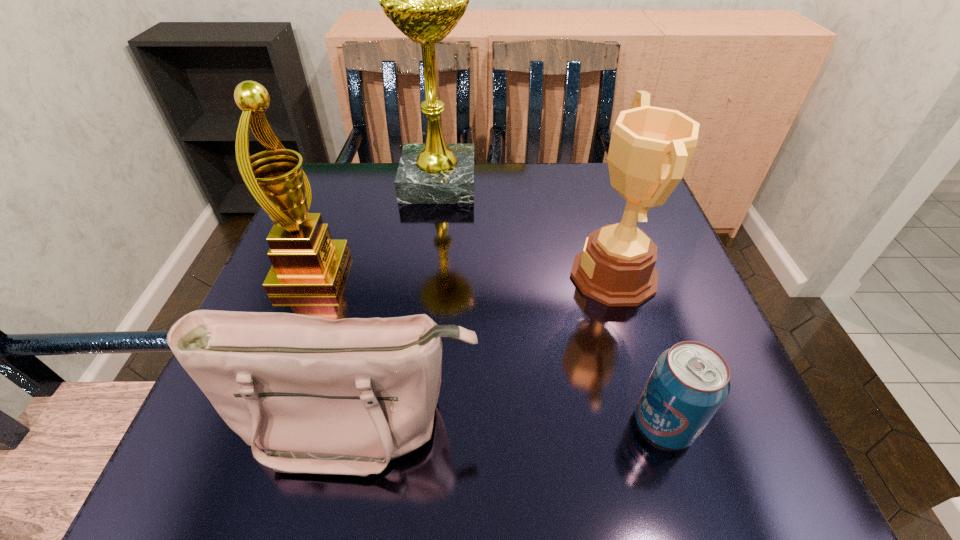
Locate an element on the screen. This screenshot has width=960, height=540. the second award from right to left is located at coordinates (425, 0).

Locate an element on the screen. the farthest object is located at coordinates (425, 0).

I want to click on the leftmost award, so point(305,259).

Where is `the rightmost award`? the rightmost award is located at coordinates (650, 149).

Locate an element on the screen. the second shortest object is located at coordinates (319, 396).

At what (x,y) coordinates should I click in order to perform the action: click on the shortest object. Please return your answer as a coordinate pair (x, y). The height and width of the screenshot is (540, 960). Looking at the image, I should click on (689, 382).

Where is `vacant space located on the front-facing side of the farthest award`? The width and height of the screenshot is (960, 540). vacant space located on the front-facing side of the farthest award is located at coordinates (626, 183).

Identify the location of vacant region located on the front-facing side of the leftmost award. This screenshot has height=540, width=960. (434, 272).

The width and height of the screenshot is (960, 540). Find the location of `vacant space located on the front-facing side of the rightmost award`. vacant space located on the front-facing side of the rightmost award is located at coordinates (464, 275).

I want to click on vacant area situated on the front-facing side of the rightmost award, so click(408, 275).